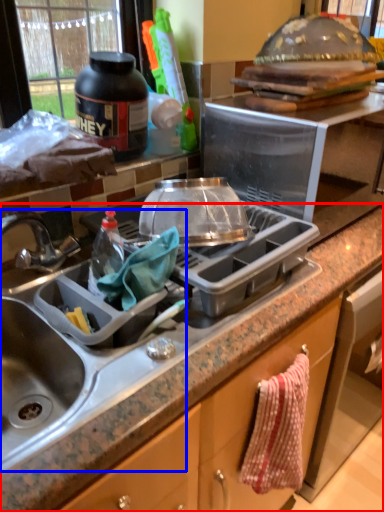
Question: Which of the following is the farthest to the observer, countertop (highlighted by a red box) or sink (highlighted by a blue box)?

Choices:
 (A) countertop
 (B) sink

Answer: (B)